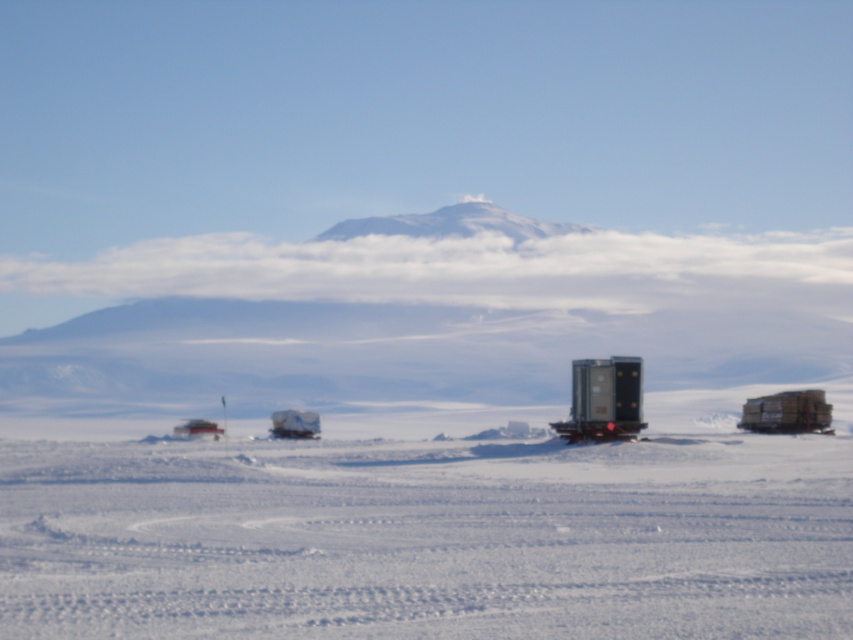
Who is positioned more to the right, metallic trailer truck at center or wooden crates at right?

wooden crates at right is more to the right.

Does point (579, 413) come closer to viewer compared to point (785, 413)?

That is True.

Which is behind, point (584, 380) or point (799, 419)?

The point (799, 419) is more distant.

Where is `metallic trailer truck at center`? This screenshot has width=853, height=640. metallic trailer truck at center is located at coordinates (602, 400).

I want to click on white matte snow at center, so click(427, 538).

Who is more distant from viewer, (347, 561) or (817, 429)?

The point (817, 429) is behind.

This screenshot has height=640, width=853. What are the coordinates of `white matte snow at center` in the screenshot? It's located at click(x=427, y=538).

Does white matte snow at center have a lesser width compared to white snow-covered mountain at center?

Correct, white matte snow at center's width is less than white snow-covered mountain at center's.

Looking at this image, measure the distance from white matte snow at center to white snow-covered mountain at center.

The distance of white matte snow at center from white snow-covered mountain at center is 81.35 meters.

The width and height of the screenshot is (853, 640). What do you see at coordinates (427, 538) in the screenshot? I see `white matte snow at center` at bounding box center [427, 538].

Where is `white matte snow at center`? Image resolution: width=853 pixels, height=640 pixels. white matte snow at center is located at coordinates (427, 538).